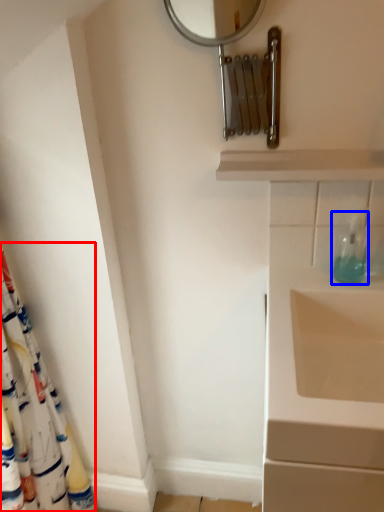
Question: Which object appears closest to the camera in this image, shower curtain (highlighted by a red box) or soap dispenser (highlighted by a blue box)?

Choices:
 (A) shower curtain
 (B) soap dispenser

Answer: (A)